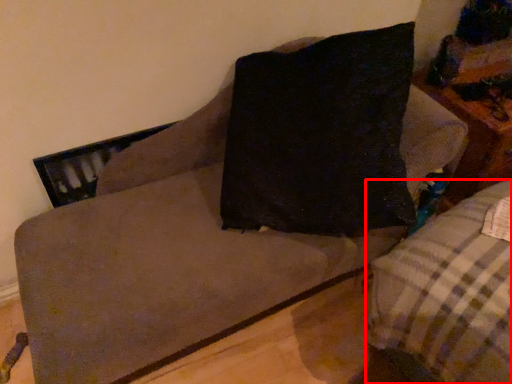
Question: Considering the relative positions of studio couch (annotated by the red box) and table in the image provided, where is studio couch (annotated by the red box) located with respect to the staircase?

Choices:
 (A) right
 (B) left

Answer: (B)